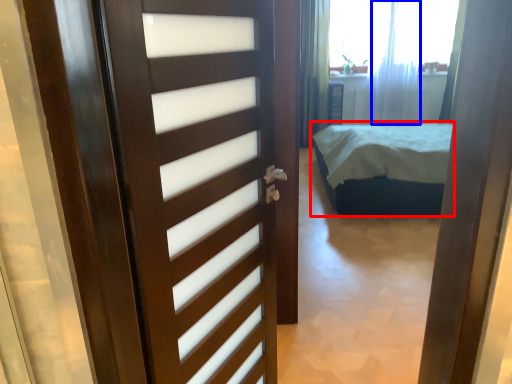
Question: Which of the following is the farthest to the observer, bed (highlighted by a red box) or curtain (highlighted by a blue box)?

Choices:
 (A) bed
 (B) curtain

Answer: (B)